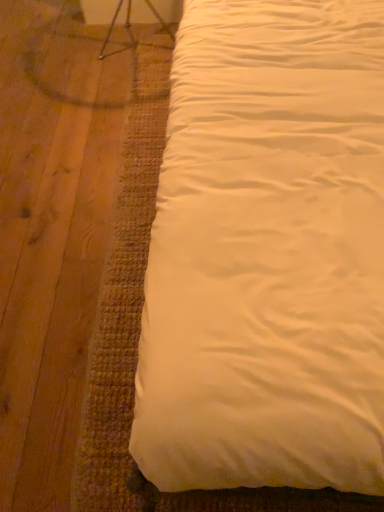
The image size is (384, 512). Describe the element at coordinates (268, 254) in the screenshot. I see `white satin bed at upper right` at that location.

From the picture: In order to face white satin bed at upper right, should I rotate leftwards or rightwards?

A 19.686 degree turn to the right will do.

I want to click on white satin bed at upper right, so click(x=268, y=254).

Identify the location of metallic silver swivel chair at upper left. This screenshot has width=384, height=512. (131, 31).

The width and height of the screenshot is (384, 512). Describe the element at coordinates (131, 31) in the screenshot. I see `metallic silver swivel chair at upper left` at that location.

Measure the distance between point (155, 8) and camera.

Point (155, 8) and camera are 2.06 meters apart from each other.

Locate an element on the screen. white satin bed at upper right is located at coordinates (268, 254).

Would you say white satin bed at upper right is to the left or to the right of metallic silver swivel chair at upper left in the picture?

Based on their positions, white satin bed at upper right is located to the right of metallic silver swivel chair at upper left.

Considering the relative positions of white satin bed at upper right and metallic silver swivel chair at upper left in the image provided, is white satin bed at upper right in front of metallic silver swivel chair at upper left?

Yes, white satin bed at upper right is in front of metallic silver swivel chair at upper left.

Is point (283, 376) in front of point (156, 18)?

Yes, it is.

From the image's perspective, which is above, white satin bed at upper right or metallic silver swivel chair at upper left?

metallic silver swivel chair at upper left, from the image's perspective.

From a real-world perspective, who is located higher, white satin bed at upper right or metallic silver swivel chair at upper left?

In real-world perspective, white satin bed at upper right is above.

Which of these two, white satin bed at upper right or metallic silver swivel chair at upper left, is thinner?

Thinner between the two is metallic silver swivel chair at upper left.

Which of these two, white satin bed at upper right or metallic silver swivel chair at upper left, stands taller?

white satin bed at upper right is taller.

From the picture: Is white satin bed at upper right bigger or smaller than metallic silver swivel chair at upper left?

white satin bed at upper right is bigger than metallic silver swivel chair at upper left.

Would you say metallic silver swivel chair at upper left is part of white satin bed at upper right's contents?

No, metallic silver swivel chair at upper left is not a part of white satin bed at upper right.

Is white satin bed at upper right positioned far away from metallic silver swivel chair at upper left?

Yes.

Is white satin bed at upper right positioned with its back to metallic silver swivel chair at upper left?

white satin bed at upper right is not turned away from metallic silver swivel chair at upper left.

How many degrees apart are the facing directions of white satin bed at upper right and metallic silver swivel chair at upper left?

0.237 degrees.

At what (x,y) coordinates should I click in order to perform the action: click on swivel chair that appears on the left of white satin bed at upper right. Please return your answer as a coordinate pair (x, y). Looking at the image, I should click on pos(131,31).

Between metallic silver swivel chair at upper left and white satin bed at upper right, which one appears on the right side from the viewer's perspective?

white satin bed at upper right is more to the right.

Considering their positions, is metallic silver swivel chair at upper left located in front of or behind white satin bed at upper right?

Visually, metallic silver swivel chair at upper left is located behind white satin bed at upper right.

Is point (156, 16) closer to camera compared to point (376, 255)?

No, it is behind (376, 255).

From the image's perspective, is metallic silver swivel chair at upper left under white satin bed at upper right?

No.

From a real-world perspective, relative to white satin bed at upper right, is metallic silver swivel chair at upper left vertically above or below?

metallic silver swivel chair at upper left is situated lower than white satin bed at upper right in the real world.

Which of these two, metallic silver swivel chair at upper left or white satin bed at upper right, is wider?

white satin bed at upper right is wider.

Considering the sizes of metallic silver swivel chair at upper left and white satin bed at upper right in the image, is metallic silver swivel chair at upper left taller or shorter than white satin bed at upper right?

Considering their sizes, metallic silver swivel chair at upper left has less height than white satin bed at upper right.

Does metallic silver swivel chair at upper left have a smaller size compared to white satin bed at upper right?

Yes.

Would you say white satin bed at upper right is part of metallic silver swivel chair at upper left's contents?

That's incorrect, white satin bed at upper right is not inside metallic silver swivel chair at upper left.

Are metallic silver swivel chair at upper left and white satin bed at upper right far apart?

Yes, metallic silver swivel chair at upper left is far from white satin bed at upper right.

Could you tell me if metallic silver swivel chair at upper left is turned towards white satin bed at upper right?

No.

What's the angular difference between metallic silver swivel chair at upper left and white satin bed at upper right's facing directions?

There is a 0.237-degree angle between the facing directions of metallic silver swivel chair at upper left and white satin bed at upper right.

Identify the location of swivel chair that is under the white satin bed at upper right (from a real-world perspective). The image size is (384, 512). click(131, 31).

The image size is (384, 512). In order to click on swivel chair on the left of white satin bed at upper right in this screenshot , I will do pos(131,31).

Identify the location of swivel chair below the white satin bed at upper right (from a real-world perspective). The width and height of the screenshot is (384, 512). (131, 31).